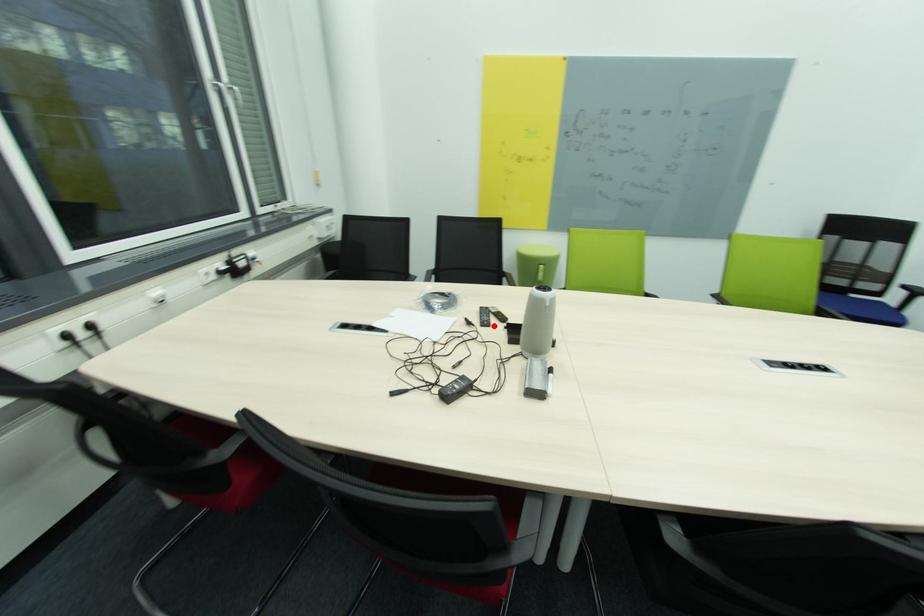
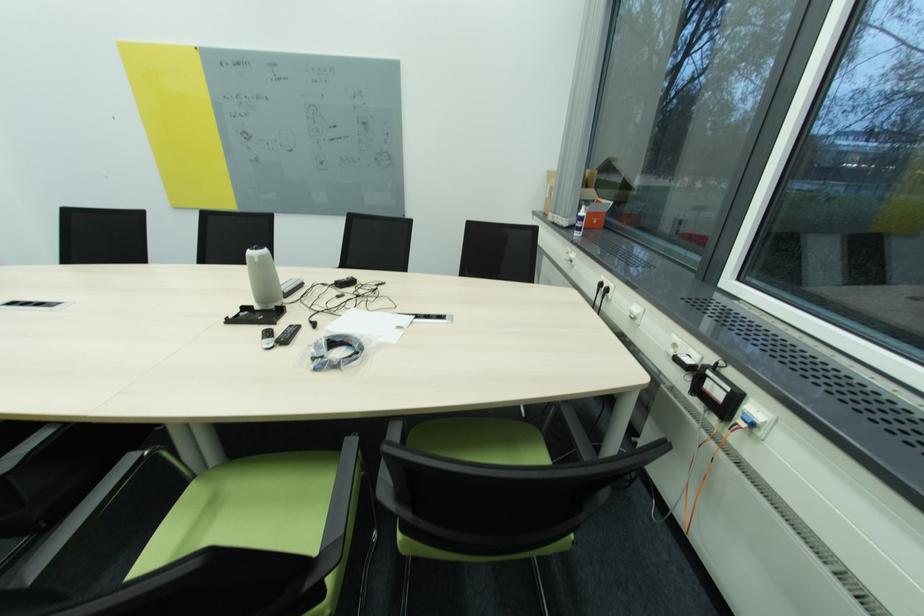
Locate, in the second image, the point that corresponds to the highlighted location in the first image.

(296, 328)